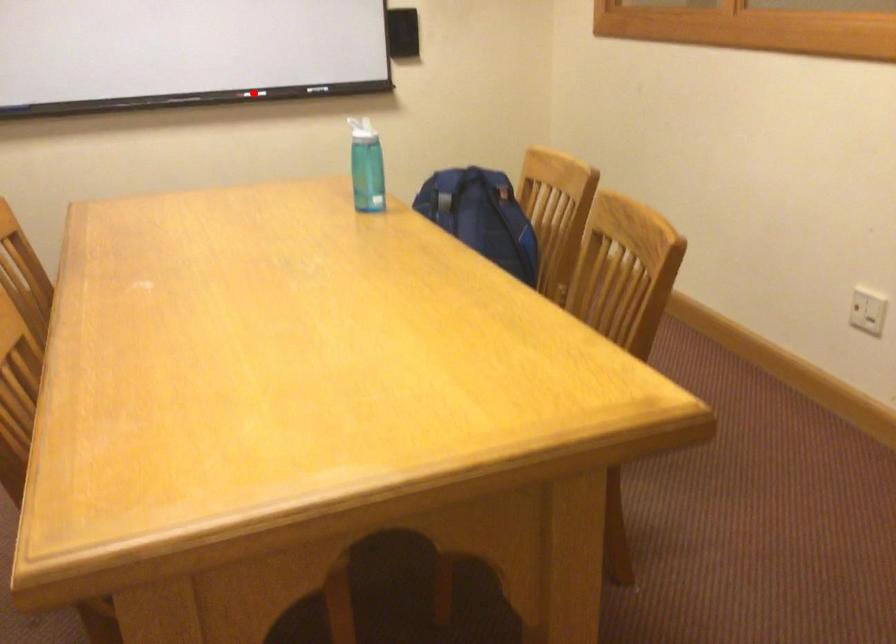
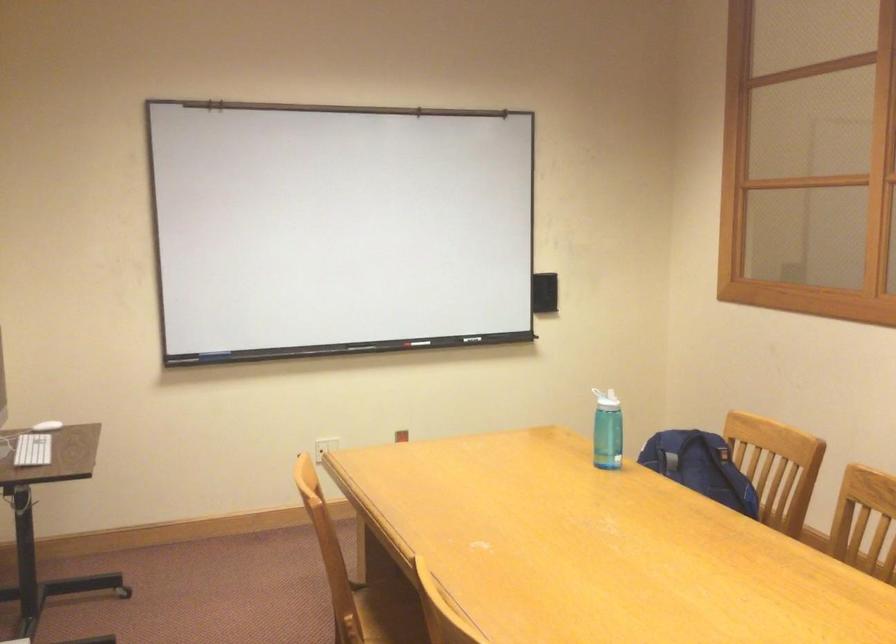
Locate, in the second image, the point that corresponds to the highlighted location in the first image.

(420, 343)